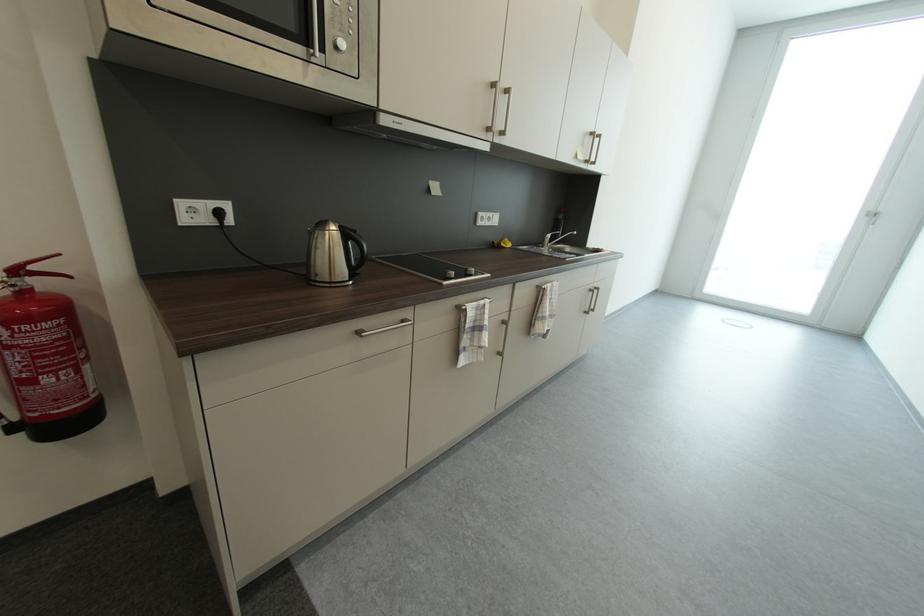
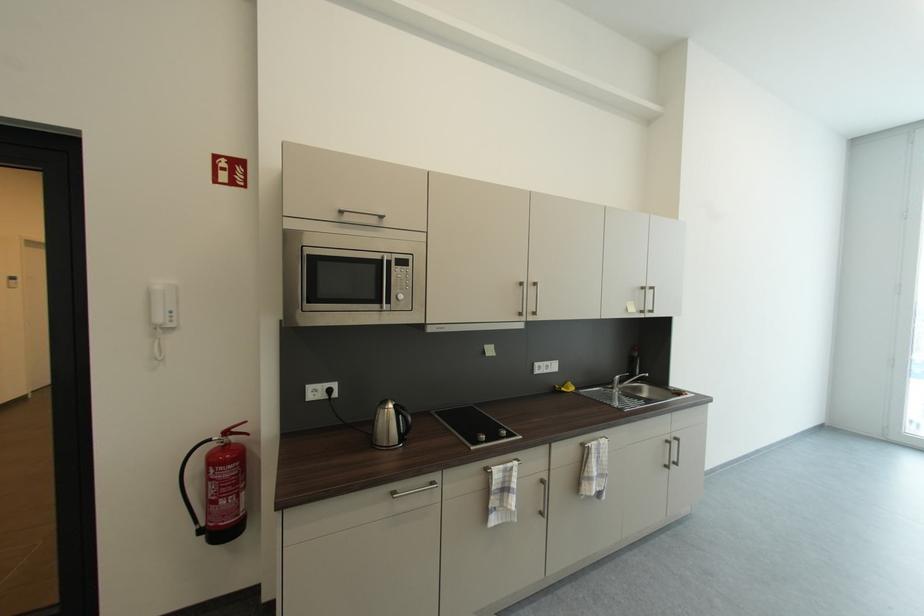
In the second image, find the point that corresponds to the point at 599,291 in the first image.

(675, 440)